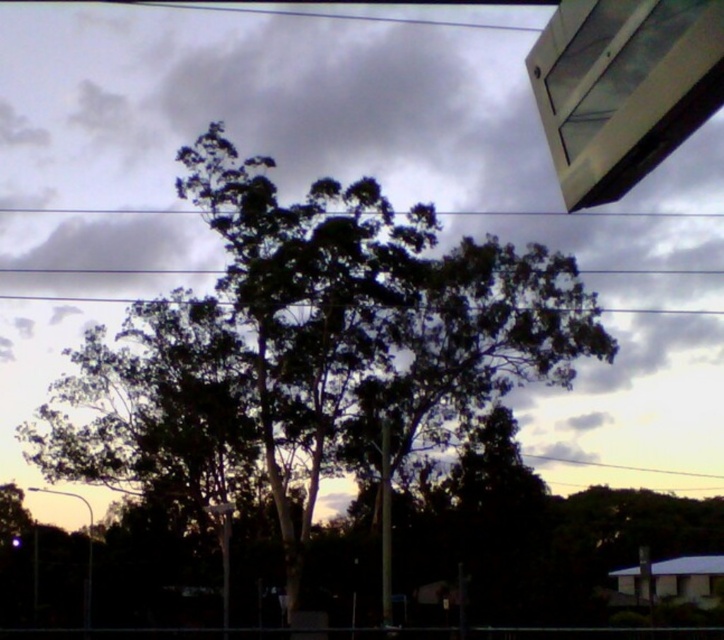
You are a bird flying over the scene and want to land on the highest point between the black wire at upper center and the white plastic street sign at lower center. Which one should you choose?

The white plastic street sign at lower center is taller than the black wire at upper center, so you should land on the white plastic street sign at lower center.

You are a bird flying at the height of the white plastic street sign at lower center. Can you see the dark gray cloud at upper center above you?

Yes, the dark gray cloud at upper center is much taller than the white plastic street sign at lower center, so the bird can see it above.